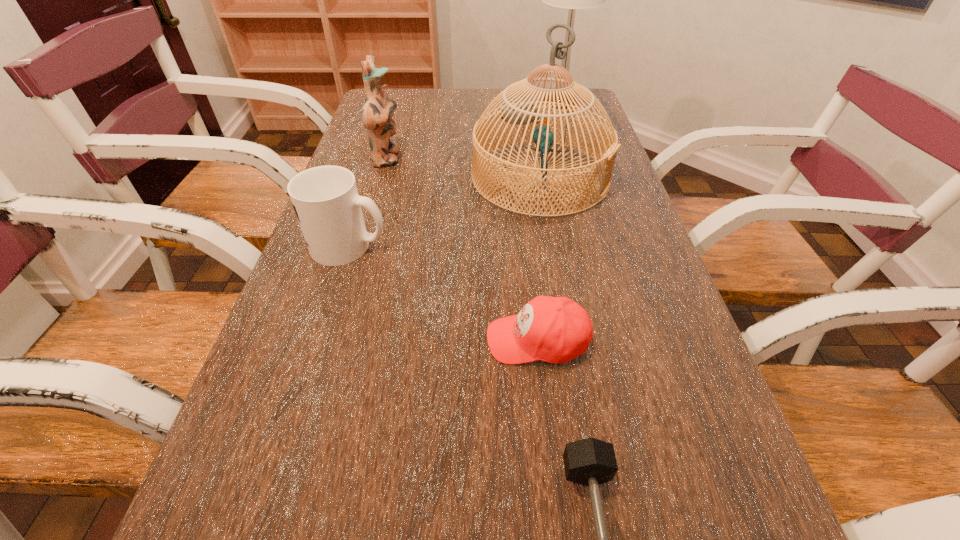
Image resolution: width=960 pixels, height=540 pixels. Find the location of `birdcage located at the right edge`. birdcage located at the right edge is located at coordinates (518, 113).

I want to click on object located in the far right corner section of the desktop, so click(572, 0).

In the image, there is a desktop. Where is `vacant space at the far edge`? The height and width of the screenshot is (540, 960). vacant space at the far edge is located at coordinates point(540,98).

Locate an element on the screen. This screenshot has height=540, width=960. vacant space at the left edge is located at coordinates click(333, 293).

What are the coordinates of `free space between the third shortest object and the farthest object` in the screenshot? It's located at (455, 174).

Image resolution: width=960 pixels, height=540 pixels. I want to click on empty space that is in between the birdcage and the fourth tallest object, so click(444, 212).

The image size is (960, 540). What are the coordinates of `free area in between the baseball cap and the fourth tallest object` in the screenshot? It's located at (444, 293).

Find the location of `free spot between the fifth tallest object and the mug`. free spot between the fifth tallest object and the mug is located at coordinates (444, 293).

Identify the location of object that is the second nearest to the farthest object. This screenshot has height=540, width=960. (378, 110).

Where is `the fourth closest object relative to the fifth shortest object`? This screenshot has width=960, height=540. the fourth closest object relative to the fifth shortest object is located at coordinates (553, 329).